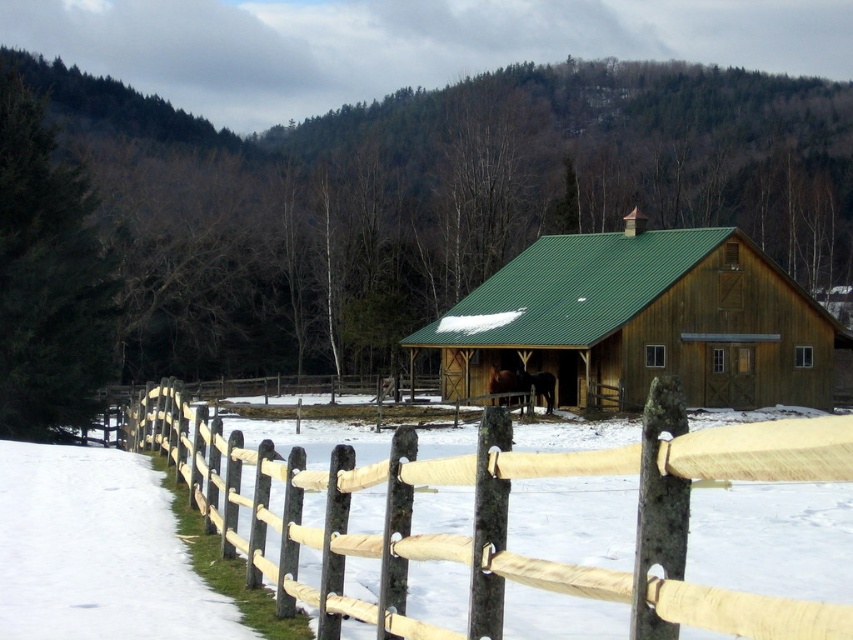
Which is in front, point (155, 426) or point (195, 598)?

Point (195, 598) is in front.

Is point (619, 449) closer to viewer compared to point (80, 524)?

Yes, it is.

Where is `wooden split rail fence at center`? The height and width of the screenshot is (640, 853). wooden split rail fence at center is located at coordinates (495, 516).

Can you confirm if wooden split rail fence at center is thinner than green wooden barn at center?

Indeed, wooden split rail fence at center has a lesser width compared to green wooden barn at center.

Can you confirm if wooden split rail fence at center is positioned below green wooden barn at center?

Yes.

Between point (318, 486) and point (730, 289), which one is positioned in front?

Positioned in front is point (318, 486).

Find the location of a particular element. wooden split rail fence at center is located at coordinates (495, 516).

Is point (561, 275) closer to viewer compared to point (196, 598)?

No, (561, 275) is behind (196, 598).

Does point (695, 330) come in front of point (55, 476)?

No, (695, 330) is further to viewer.

Locate an element on the screen. The height and width of the screenshot is (640, 853). green wooden barn at center is located at coordinates (642, 321).